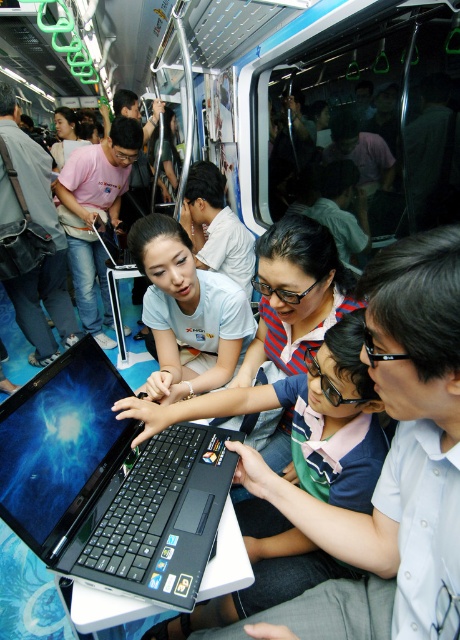
You are a passenger on the subway train and want to look at the laptop screen. The black plastic laptop at center and the matte white shirt at center are in your view. Which object is positioned to the left when viewing from your perspective?

The black plastic laptop at center is positioned to the left of the matte white shirt at center.

You are standing on the subway train and see the point at coordinates (188, 310). What object is located at that point?

The point at coordinates (188, 310) indicates the matte white shirt at center.

You are standing on the subway train and want to take a photo of both the point at coordinates point (102,336) and point (228,212). Which point should you focus on first to ensure both are in focus?

You should focus on point (228,212) first because it is closer to you than point (102,336), which is further away. By focusing on the closer point, the further point will also be in focus due to depth of field.